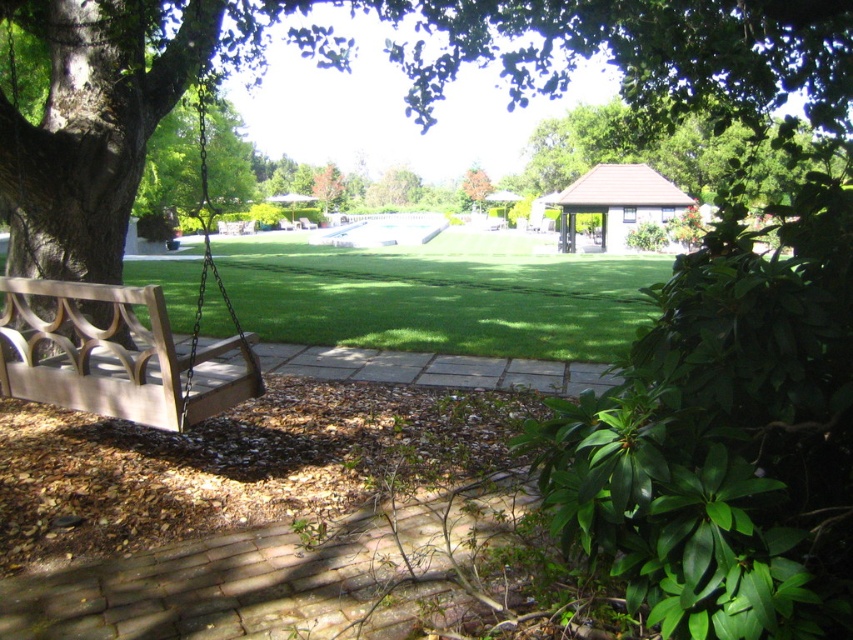
Question: Which object appears farthest from the camera in this image?

Choices:
 (A) green leafy tree at left
 (B) brown wood tree at left
 (C) green grass at center

Answer: (A)

Question: Which object is farther from the camera taking this photo?

Choices:
 (A) brown wood tree at left
 (B) orange matte tree at upper center
 (C) green leafy tree at left
 (D) green grass at center

Answer: (B)

Question: Which point is closer to the camera?

Choices:
 (A) green leafy tree at left
 (B) orange matte tree at upper center

Answer: (A)

Question: Does wooden park bench at left have a smaller size compared to orange matte tree at upper center?

Choices:
 (A) yes
 (B) no

Answer: (A)

Question: Does green grass at center appear on the left side of green leafy tree at left?

Choices:
 (A) no
 (B) yes

Answer: (A)

Question: Can you confirm if green leafy tree at left is thinner than orange matte tree at upper center?

Choices:
 (A) no
 (B) yes

Answer: (A)